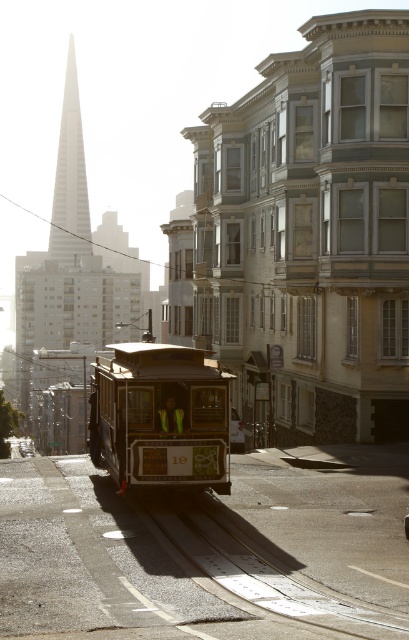
You are standing at the starting point of the cable car route in San Francisco. You see two points marked on the map, point 1 at coordinates point (x=242, y=564) and point 2 at coordinates point (x=231, y=440). Which point is closer to the cable car as it travels along its route?

Point (x=242, y=564) is in front of point (x=231, y=440), so the cable car will reach point (x=242, y=564) first as it travels along its route.

From the picture: You are standing at the point where the cable car is currently located. There is a metal smooth track at center represented by point (x=256, y=568). If you walk straight ahead, will you stay on the track?

The metal smooth track at center is represented by point (x=256, y=568). Since the cable car is on the track, walking straight ahead from that point would keep you on the track.

You are a tourist standing on the sidewalk and want to take a photo of both the shiny brown cable car at center and the white glass spire at upper center. Which object should you zoom in more on to ensure both are in focus?

You should zoom in more on the white glass spire at upper center because it occupies more space than the shiny brown cable car at center, so it requires a closer focus to capture its details while keeping the cable car in the frame.